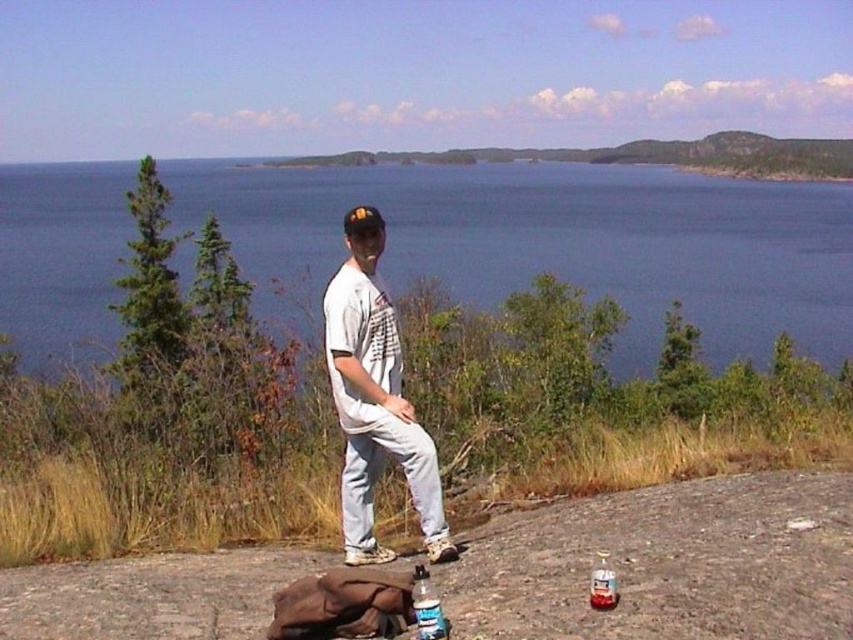
Between point (368, 364) and point (606, 600), which one is positioned behind?

Positioned behind is point (368, 364).

Which is in front, point (432, 508) or point (601, 596)?

Point (601, 596) is in front.

Where is `white cotton t-shirt at center`? white cotton t-shirt at center is located at coordinates (374, 397).

Does translucent plastic bottle at lower center have a lesser width compared to clear plastic bottle at lower right?

No, translucent plastic bottle at lower center is not thinner than clear plastic bottle at lower right.

Does translucent plastic bottle at lower center appear on the left side of clear plastic bottle at lower right?

Indeed, translucent plastic bottle at lower center is positioned on the left side of clear plastic bottle at lower right.

Who is more forward, (416, 602) or (589, 598)?

Point (416, 602) is in front.

Locate an element on the screen. translucent plastic bottle at lower center is located at coordinates (426, 608).

Find the location of a particular element. white cotton t-shirt at center is located at coordinates (374, 397).

The height and width of the screenshot is (640, 853). Describe the element at coordinates (374, 397) in the screenshot. I see `white cotton t-shirt at center` at that location.

Locate an element on the screen. The image size is (853, 640). white cotton t-shirt at center is located at coordinates (374, 397).